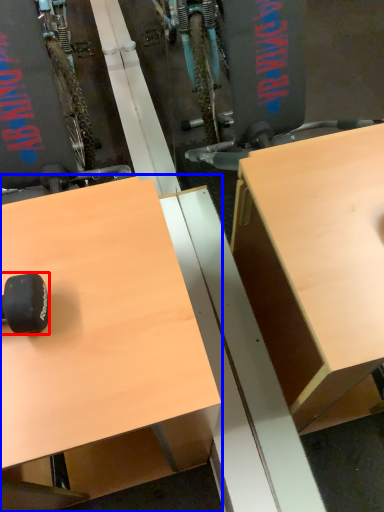
Question: Which object appears farthest to the camera in this image, wheel (highlighted by a red box) or desk (highlighted by a blue box)?

Choices:
 (A) wheel
 (B) desk

Answer: (A)